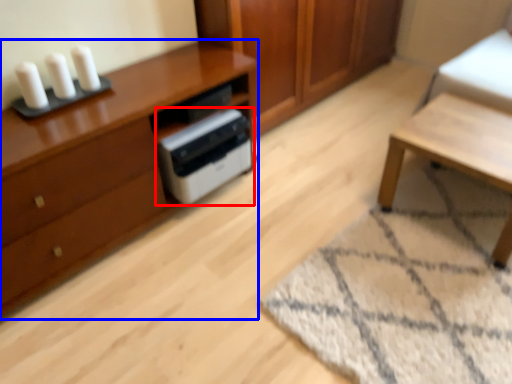
Question: Which of the following is the closest to the observer, home appliance (highlighted by a red box) or chest of drawers (highlighted by a blue box)?

Choices:
 (A) home appliance
 (B) chest of drawers

Answer: (B)